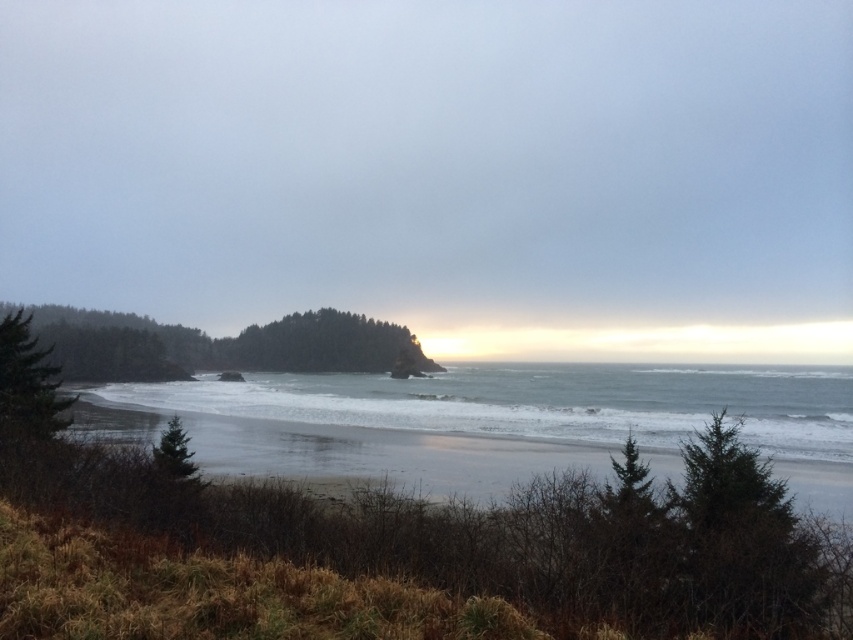
Question: Does grayish-blue water at center have a smaller size compared to green matte tree at center?

Choices:
 (A) no
 (B) yes

Answer: (A)

Question: Among these points, which one is nearest to the camera?

Choices:
 (A) (28, 348)
 (B) (804, 467)
 (C) (699, 452)
 (D) (138, 317)

Answer: (C)

Question: Which of these objects is positioned farthest from the green matte tree at center?

Choices:
 (A) grayish-blue water at center
 (B) green textured tree at lower right

Answer: (B)

Question: Can you confirm if grayish-blue water at center is positioned below green matte tree at center?

Choices:
 (A) yes
 (B) no

Answer: (A)

Question: Does green textured tree at lower right appear on the left side of green matte tree at left?

Choices:
 (A) no
 (B) yes

Answer: (A)

Question: Which object appears closest to the camera in this image?

Choices:
 (A) grayish-blue water at center
 (B) green matte tree at left
 (C) green textured tree at lower right

Answer: (C)